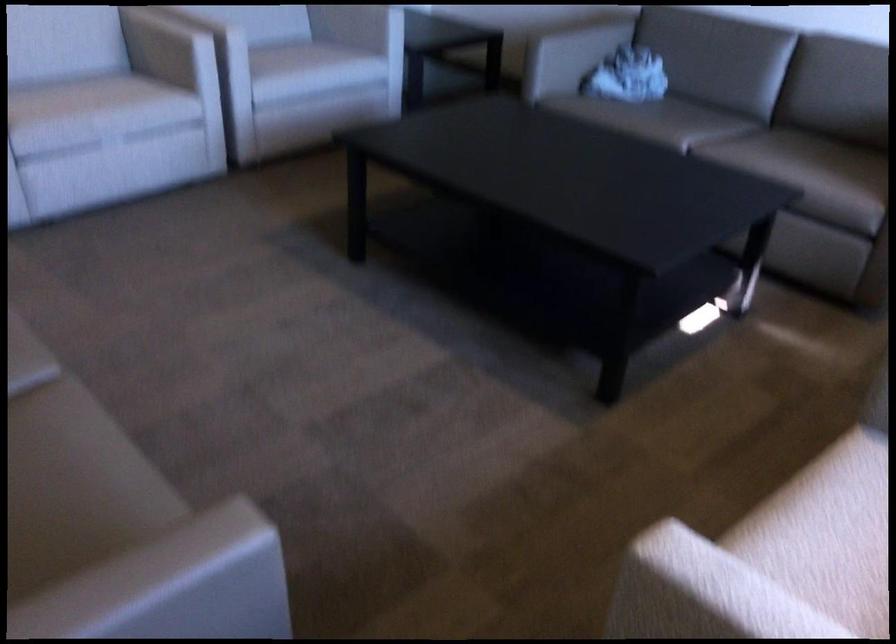
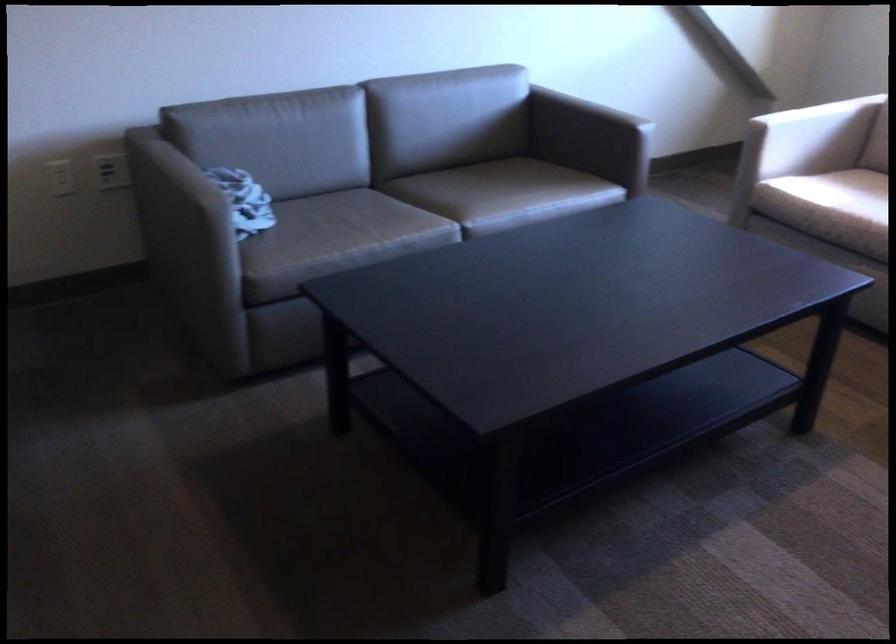
Find the pixel in the second image that matches the point at 755,151 in the first image.

(489, 194)